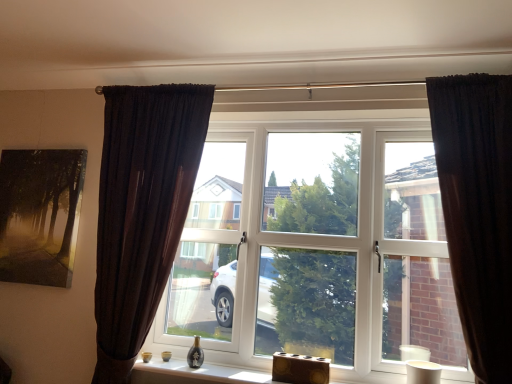
Question: In terms of width, does matte black painting at upper left look wider or thinner when compared to dark velvet curtain at right, the 1th curtain positioned from the right?

Choices:
 (A) thin
 (B) wide

Answer: (A)

Question: Based on their positions, is matte black painting at upper left located to the left or right of dark velvet curtain at right, the 1th curtain positioned from the right?

Choices:
 (A) left
 (B) right

Answer: (A)

Question: Which is farther from the wooden block at lower center?

Choices:
 (A) white plastic window at center
 (B) wooden block at lower center
 (C) matte black painting at upper left
 (D) dark brown fabric curtain at left, marked as the 2th curtain in a right-to-left arrangement
 (E) dark velvet curtain at right, the 1th curtain positioned from the right

Answer: (C)

Question: Based on their relative distances, which object is farther from the matte black painting at upper left?

Choices:
 (A) dark brown fabric curtain at left, marked as the 2th curtain in a right-to-left arrangement
 (B) white plastic window at center
 (C) wooden block at lower center
 (D) wooden block at lower center
 (E) dark velvet curtain at right, which appears as the second curtain when viewed from the left

Answer: (E)